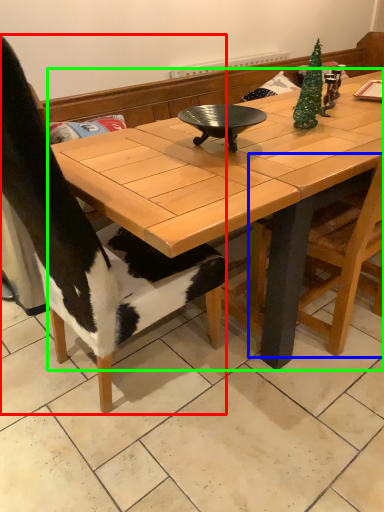
Question: Estimate the real-world distances between objects in this image. Which object is closer to chair (highlighted by a red box), chair (highlighted by a blue box) or coffee table (highlighted by a green box)?

Choices:
 (A) chair
 (B) coffee table

Answer: (B)